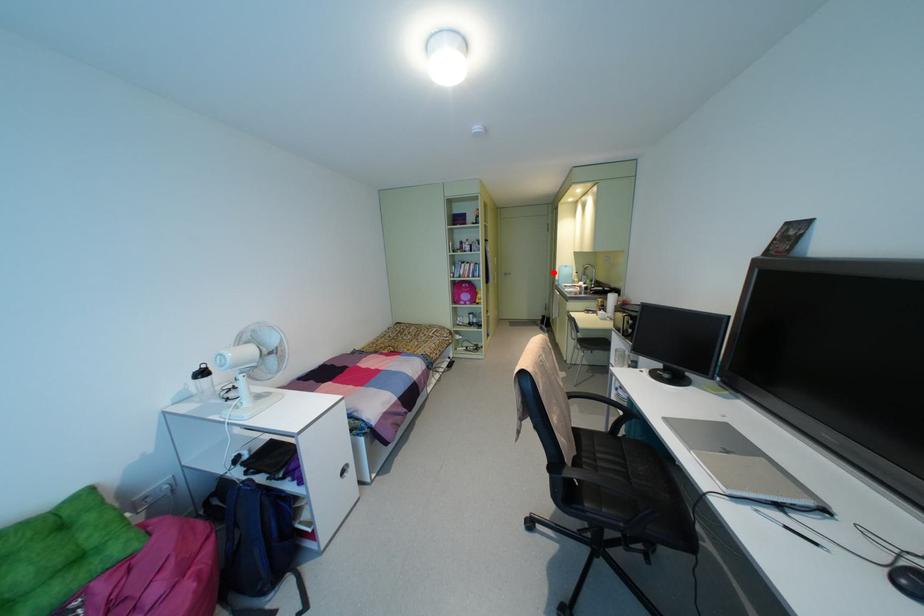
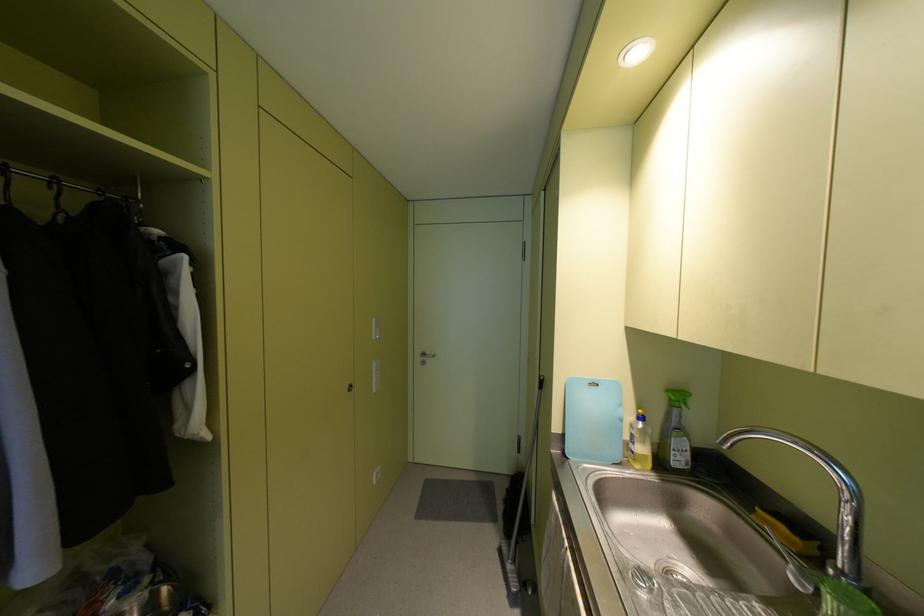
Locate, in the second image, the point that corresponds to the highlighted location in the first image.

(542, 384)